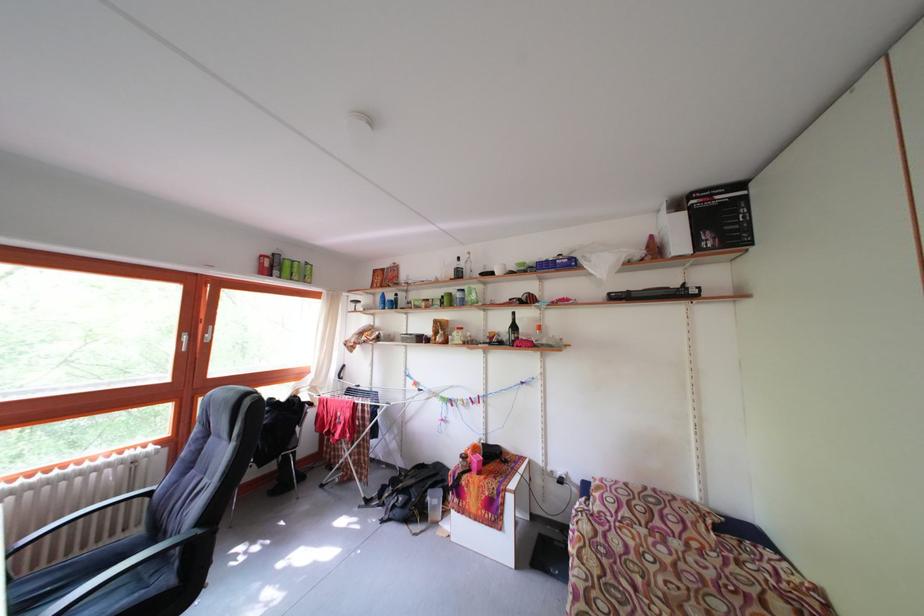
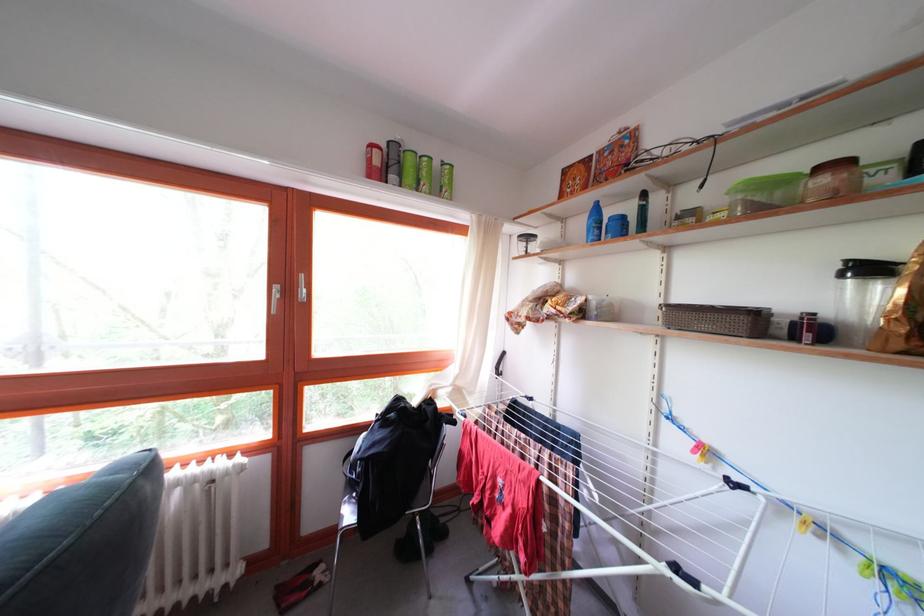
Question: I am providing you with two images of the same scene from different viewpoints. Please identify which objects are invisible in image2.

Choices:
 (A) brown lidded jar
 (B) brown woven basket
 (C) green cylindrical can
 (D) none of these

Answer: (D)